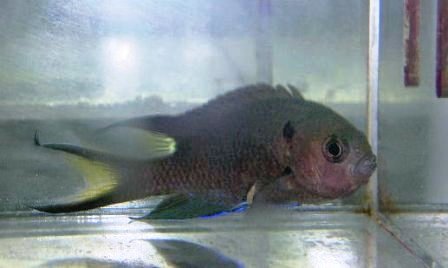
Image resolution: width=448 pixels, height=268 pixels. Identify the location of glass fish tank. (420, 115).